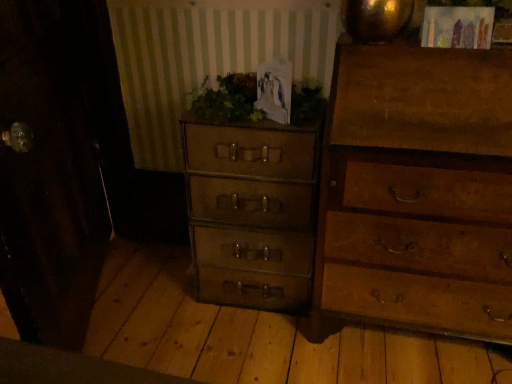
Question: From a real-world perspective, is wooden chest of drawers at right, acting as the 1th chest of drawers starting from the right, physically above green leafy plant at center?

Choices:
 (A) yes
 (B) no

Answer: (B)

Question: Is green leafy plant at center surrounded by wooden chest of drawers at right, marked as the 2th chest of drawers in a left-to-right arrangement?

Choices:
 (A) yes
 (B) no

Answer: (B)

Question: Is wooden chest of drawers at right, acting as the 1th chest of drawers starting from the right, at the left side of green leafy plant at center?

Choices:
 (A) yes
 (B) no

Answer: (B)

Question: From the image's perspective, would you say wooden chest of drawers at right, marked as the 2th chest of drawers in a left-to-right arrangement, is positioned over green leafy plant at center?

Choices:
 (A) no
 (B) yes

Answer: (A)

Question: Does wooden chest of drawers at right, acting as the 1th chest of drawers starting from the right, have a lesser width compared to green leafy plant at center?

Choices:
 (A) yes
 (B) no

Answer: (B)

Question: Would you say green leafy plant at center is inside or outside matte brown suitcase at center, which is the 1th chest of drawers from left to right?

Choices:
 (A) outside
 (B) inside

Answer: (A)

Question: From a real-world perspective, is green leafy plant at center above or below matte brown suitcase at center, which is the 1th chest of drawers from left to right?

Choices:
 (A) above
 (B) below

Answer: (A)

Question: Is point (206, 81) closer or farther from the camera than point (301, 264)?

Choices:
 (A) farther
 (B) closer

Answer: (B)

Question: From the image's perspective, is green leafy plant at center above or below matte brown suitcase at center, which is the 1th chest of drawers from left to right?

Choices:
 (A) below
 (B) above

Answer: (B)

Question: Is wooden chest of drawers at right, acting as the 1th chest of drawers starting from the right, to the left or to the right of matte brown suitcase at center, which is the 1th chest of drawers from left to right, in the image?

Choices:
 (A) right
 (B) left

Answer: (A)

Question: Based on their sizes in the image, would you say wooden chest of drawers at right, acting as the 1th chest of drawers starting from the right, is bigger or smaller than matte brown suitcase at center, the 2th chest of drawers from the right?

Choices:
 (A) big
 (B) small

Answer: (A)

Question: From a real-world perspective, is wooden chest of drawers at right, acting as the 1th chest of drawers starting from the right, positioned above or below matte brown suitcase at center, which is the 1th chest of drawers from left to right?

Choices:
 (A) above
 (B) below

Answer: (A)

Question: Do you think wooden chest of drawers at right, marked as the 2th chest of drawers in a left-to-right arrangement, is within matte brown suitcase at center, the 2th chest of drawers from the right, or outside of it?

Choices:
 (A) inside
 (B) outside

Answer: (B)

Question: Considering the positions of green leafy plant at center and wooden chest of drawers at right, marked as the 2th chest of drawers in a left-to-right arrangement, in the image, is green leafy plant at center bigger or smaller than wooden chest of drawers at right, marked as the 2th chest of drawers in a left-to-right arrangement,?

Choices:
 (A) big
 (B) small

Answer: (B)

Question: From the image's perspective, is green leafy plant at center located above or below wooden chest of drawers at right, acting as the 1th chest of drawers starting from the right?

Choices:
 (A) below
 (B) above

Answer: (B)